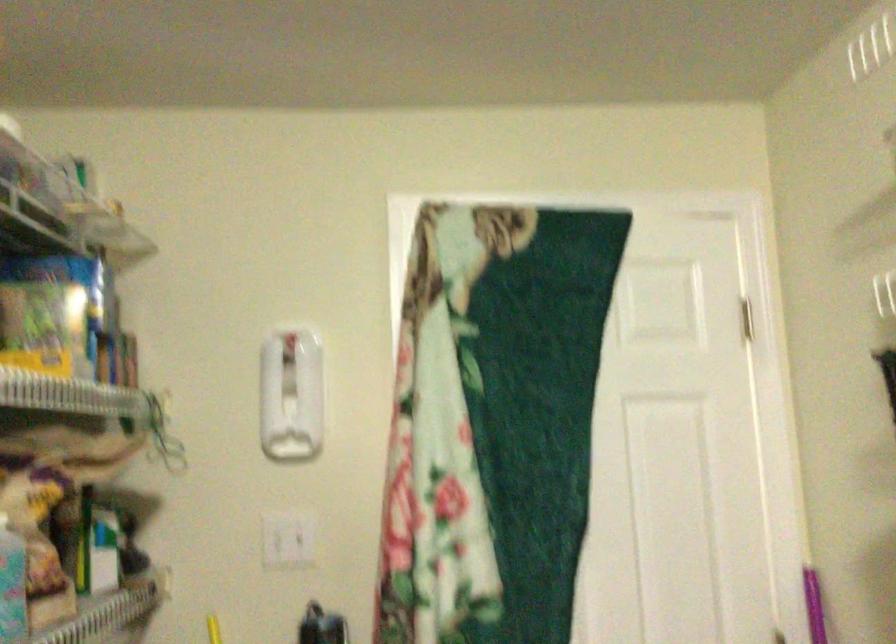
Find where to push the light switch. Please return your answer as a coordinate pair (x, y).

(288, 538)